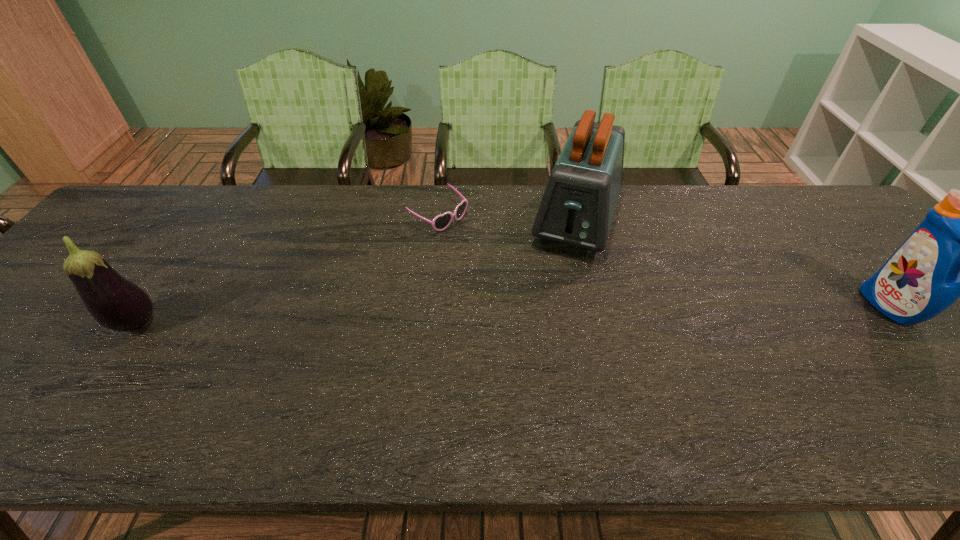
At what (x,y) coordinates should I click in order to perform the action: click on vacant space located 0.390m on the front-facing side of the second object from left to right. Please return your answer as a coordinate pair (x, y). This screenshot has width=960, height=540. Looking at the image, I should click on point(569,299).

Identify the location of free spot located 0.250m on the front-facing side of the second object from left to right. This screenshot has height=540, width=960. (525, 272).

At what (x,y) coordinates should I click in order to perform the action: click on vacant space positioned on the front-facing side of the toaster. Please return your answer as a coordinate pair (x, y). This screenshot has height=540, width=960. Looking at the image, I should click on (551, 307).

I want to click on vacant space located 0.270m on the front-facing side of the toaster, so click(x=540, y=338).

The width and height of the screenshot is (960, 540). What are the coordinates of `vacant space positioned 0.290m on the front-facing side of the toaster` in the screenshot? It's located at (538, 344).

In order to click on sunglasses present at the far edge in this screenshot , I will do `click(441, 222)`.

Where is `toaster at the far edge`? Image resolution: width=960 pixels, height=540 pixels. toaster at the far edge is located at coordinates (577, 208).

The image size is (960, 540). In order to click on object present at the right edge in this screenshot , I will do `click(959, 250)`.

At what (x,y) coordinates should I click in order to perform the action: click on vacant space at the far edge. Please return your answer as a coordinate pair (x, y). This screenshot has width=960, height=540. Looking at the image, I should click on click(x=524, y=199).

Where is `vacant space at the near edge of the desktop`? The height and width of the screenshot is (540, 960). vacant space at the near edge of the desktop is located at coordinates (922, 397).